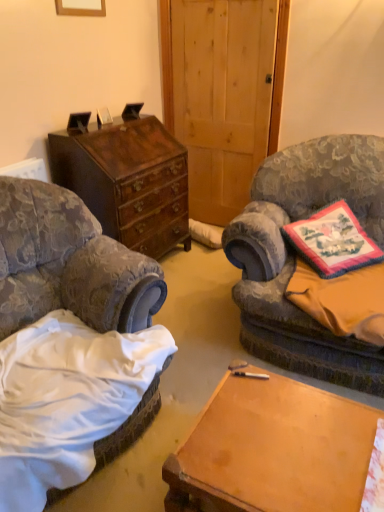
What do you see at coordinates (128, 181) in the screenshot?
I see `mahogany wood chest of drawers at left` at bounding box center [128, 181].

The image size is (384, 512). What do you see at coordinates (375, 475) in the screenshot?
I see `floral fabric sheet at lower right, which is counted as the second sheet, starting from the back` at bounding box center [375, 475].

Find the location of a particular element. The width and height of the screenshot is (384, 512). floral fabric sheet at lower right, the 2th sheet when ordered from top to bottom is located at coordinates (375, 475).

What is the approximate height of velvet floral chair at right, the 1th chair in the right-to-left sequence?

37.84 inches.

I want to click on wooden desk at center, so click(x=273, y=450).

Find the location of a particular element. embroidered fabric pillow at right is located at coordinates (333, 241).

Describe the element at coordinates (81, 7) in the screenshot. This screenshot has width=384, height=512. I see `wooden picture frame at upper center` at that location.

Where is `orange fabric pillow at right, the 2th sheet positioned from the bottom`? The width and height of the screenshot is (384, 512). orange fabric pillow at right, the 2th sheet positioned from the bottom is located at coordinates (342, 300).

Considering the sizes of wooden picture frame at upper center and velvet-patterned armchair at left, which is counted as the 1th chair, starting from the left, in the image, is wooden picture frame at upper center wider or thinner than velvet-patterned armchair at left, which is counted as the 1th chair, starting from the left,?

wooden picture frame at upper center is thinner than velvet-patterned armchair at left, which is counted as the 1th chair, starting from the left.

Are wooden picture frame at upper center and velvet-patterned armchair at left, which is counted as the 1th chair, starting from the left, located far from each other?

Yes, wooden picture frame at upper center is far from velvet-patterned armchair at left, which is counted as the 1th chair, starting from the left.

Considering the relative sizes of wooden picture frame at upper center and velvet-patterned armchair at left, which is counted as the 1th chair, starting from the left, in the image provided, is wooden picture frame at upper center smaller than velvet-patterned armchair at left, which is counted as the 1th chair, starting from the left,?

Yes, wooden picture frame at upper center is smaller than velvet-patterned armchair at left, which is counted as the 1th chair, starting from the left.

Is embroidered fabric pillow at right surrounding velvet floral chair at right, the 1th chair in the right-to-left sequence?

No, embroidered fabric pillow at right does not contain velvet floral chair at right, the 1th chair in the right-to-left sequence.

Considering the sizes of objects embroidered fabric pillow at right and velvet floral chair at right, the second chair in the left-to-right sequence, in the image provided, who is smaller, embroidered fabric pillow at right or velvet floral chair at right, the second chair in the left-to-right sequence,?

Smaller between the two is embroidered fabric pillow at right.

From a real-world perspective, is embroidered fabric pillow at right physically above velvet floral chair at right, the second chair in the left-to-right sequence?

Yes, from a real-world perspective, embroidered fabric pillow at right is over velvet floral chair at right, the second chair in the left-to-right sequence

Relative to velvet floral chair at right, the second chair in the left-to-right sequence, is embroidered fabric pillow at right in front or behind?

embroidered fabric pillow at right is behind velvet floral chair at right, the second chair in the left-to-right sequence.

Does velvet floral chair at right, the 1th chair in the right-to-left sequence, appear on the right side of velvet-patterned armchair at left, which appears as the 2th chair when viewed from the right?

Indeed, velvet floral chair at right, the 1th chair in the right-to-left sequence, is positioned on the right side of velvet-patterned armchair at left, which appears as the 2th chair when viewed from the right.

How far apart are velvet floral chair at right, the second chair in the left-to-right sequence, and velvet-patterned armchair at left, which appears as the 2th chair when viewed from the right?

30.73 inches.

From a real-world perspective, is velvet floral chair at right, the second chair in the left-to-right sequence, above or below velvet-patterned armchair at left, which appears as the 2th chair when viewed from the right?

velvet floral chair at right, the second chair in the left-to-right sequence, is above velvet-patterned armchair at left, which appears as the 2th chair when viewed from the right.

Is velvet floral chair at right, the second chair in the left-to-right sequence, oriented away from velvet-patterned armchair at left, which appears as the 2th chair when viewed from the right?

No, velvet-patterned armchair at left, which appears as the 2th chair when viewed from the right, is not at the back of velvet floral chair at right, the second chair in the left-to-right sequence.

This screenshot has height=512, width=384. Find the location of `picture frame behind the velvet-patterned armchair at left, which appears as the 2th chair when viewed from the right`. picture frame behind the velvet-patterned armchair at left, which appears as the 2th chair when viewed from the right is located at coordinates (81, 7).

Between point (58, 201) and point (102, 9), which one is positioned behind?

The point (102, 9) is farther from the camera.

Is velvet-patterned armchair at left, which is counted as the 1th chair, starting from the left, aimed at wooden picture frame at upper center?

No, velvet-patterned armchair at left, which is counted as the 1th chair, starting from the left, is not aimed at wooden picture frame at upper center.

Considering the relative positions of velvet floral chair at right, the 1th chair in the right-to-left sequence, and wooden desk at center in the image provided, is velvet floral chair at right, the 1th chair in the right-to-left sequence, to the left or to the right of wooden desk at center?

Clearly, velvet floral chair at right, the 1th chair in the right-to-left sequence, is on the right of wooden desk at center in the image.

Is velvet floral chair at right, the 1th chair in the right-to-left sequence, thinner than wooden desk at center?

Incorrect, the width of velvet floral chair at right, the 1th chair in the right-to-left sequence, is not less than that of wooden desk at center.

Find the location of a particular element. chair that appears on the right of wooden desk at center is located at coordinates (295, 255).

How many degrees apart are the facing directions of velvet floral chair at right, the 1th chair in the right-to-left sequence, and wooden desk at center?

There is a 4.52-degree angle between the facing directions of velvet floral chair at right, the 1th chair in the right-to-left sequence, and wooden desk at center.

Measure the distance between mahogany wood chest of drawers at left and embroidered fabric pillow at right.

They are 3.43 feet apart.

Is point (160, 172) farther from viewer compared to point (326, 252)?

Yes, it is.

Can you see mahogany wood chest of drawers at left touching embroidered fabric pillow at right?

mahogany wood chest of drawers at left and embroidered fabric pillow at right are clearly separated.

At what (x,y) coordinates should I click in order to perform the action: click on the chest of drawers behind the embroidered fabric pillow at right. Please return your answer as a coordinate pair (x, y). This screenshot has height=512, width=384. Looking at the image, I should click on (128, 181).

Consider the image. Can you confirm if orange fabric pillow at right, the 2th sheet positioned from the bottom, is thinner than mahogany wood chest of drawers at left?

In fact, orange fabric pillow at right, the 2th sheet positioned from the bottom, might be wider than mahogany wood chest of drawers at left.

How distant is orange fabric pillow at right, the 2th sheet positioned from the bottom, from mahogany wood chest of drawers at left?

3.90 feet.

The image size is (384, 512). Find the location of `chest of drawers behind the orange fabric pillow at right, the 2th sheet positioned from the bottom`. chest of drawers behind the orange fabric pillow at right, the 2th sheet positioned from the bottom is located at coordinates (128, 181).

From a real-world perspective, between orange fabric pillow at right, arranged as the first sheet when viewed from the back, and mahogany wood chest of drawers at left, who is vertically lower?

orange fabric pillow at right, arranged as the first sheet when viewed from the back, is physically lower.

Locate an element on the screen. The height and width of the screenshot is (512, 384). the 2nd chair located beneath the wooden picture frame at upper center (from a real-world perspective) is located at coordinates (69, 264).

At what (x,y) coordinates should I click in order to perform the action: click on pillow behind the velvet floral chair at right, the 1th chair in the right-to-left sequence. Please return your answer as a coordinate pair (x, y). Looking at the image, I should click on (333, 241).

Based on their spatial positions, is embroidered fabric pillow at right or wooden desk at center further from velvet floral chair at right, the 1th chair in the right-to-left sequence?

wooden desk at center is further to velvet floral chair at right, the 1th chair in the right-to-left sequence.

Considering their positions, is velvet-patterned armchair at left, which is counted as the 1th chair, starting from the left, positioned further to mahogany wood chest of drawers at left than orange fabric pillow at right, the first sheet viewed from the top?

orange fabric pillow at right, the first sheet viewed from the top, is further to mahogany wood chest of drawers at left.

Estimate the real-world distances between objects in this image. Which object is closer to mahogany wood chest of drawers at left, wooden desk at center or floral fabric sheet at lower right, placed as the 1th sheet when sorted from front to back?

The object closer to mahogany wood chest of drawers at left is wooden desk at center.

From the image, which object appears to be nearer to mahogany wood chest of drawers at left, floral fabric sheet at lower right, marked as the 1th sheet in a bottom-to-top arrangement, or wooden picture frame at upper center?

The object closer to mahogany wood chest of drawers at left is wooden picture frame at upper center.

When comparing their distances from wooden desk at center, does embroidered fabric pillow at right or velvet-patterned armchair at left, which is counted as the 1th chair, starting from the left, seem further?

Among the two, embroidered fabric pillow at right is located further to wooden desk at center.

Considering their positions, is wooden desk at center positioned closer to mahogany wood chest of drawers at left than wooden picture frame at upper center?

wooden picture frame at upper center.

From the image, which object appears to be nearer to wooden picture frame at upper center, floral fabric sheet at lower right, placed as the 1th sheet when sorted from front to back, or velvet-patterned armchair at left, which appears as the 2th chair when viewed from the right?

velvet-patterned armchair at left, which appears as the 2th chair when viewed from the right.

When comparing their distances from floral fabric sheet at lower right, placed as the 1th sheet when sorted from front to back, does velvet floral chair at right, the 1th chair in the right-to-left sequence, or velvet-patterned armchair at left, which appears as the 2th chair when viewed from the right, seem further?

Among the two, velvet-patterned armchair at left, which appears as the 2th chair when viewed from the right, is located further to floral fabric sheet at lower right, placed as the 1th sheet when sorted from front to back.

What are the coordinates of `the chest of drawers between wooden picture frame at upper center and floral fabric sheet at lower right, which is counted as the second sheet, starting from the back, vertically` in the screenshot? It's located at (128, 181).

Find the location of `sheet between wooden desk at center and orange fabric pillow at right, arranged as the first sheet when viewed from the back, from front to back`. sheet between wooden desk at center and orange fabric pillow at right, arranged as the first sheet when viewed from the back, from front to back is located at coordinates (375, 475).

Find the location of a particular element. This screenshot has height=512, width=384. chest of drawers between velvet-patterned armchair at left, which appears as the 2th chair when viewed from the right, and embroidered fabric pillow at right from left to right is located at coordinates (128, 181).

Find the location of a particular element. sheet situated between velvet-patterned armchair at left, which appears as the 2th chair when viewed from the right, and velvet floral chair at right, the 1th chair in the right-to-left sequence, from left to right is located at coordinates (375, 475).